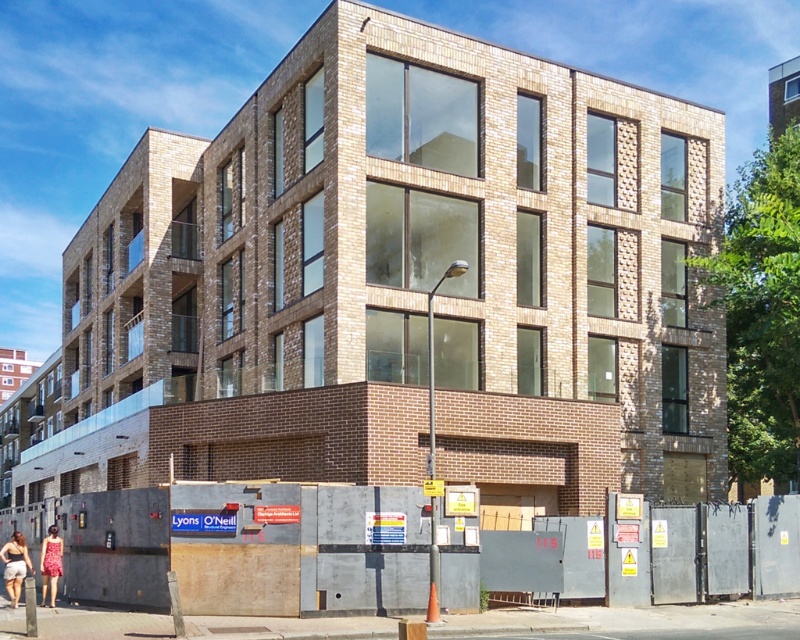
Question: Is light pink cotton dress at lower left to the right of floral dress at lower left from the viewer's perspective?

Choices:
 (A) no
 (B) yes

Answer: (A)

Question: Which object appears farthest from the camera in this image?

Choices:
 (A) floral dress at lower left
 (B) light pink cotton dress at lower left

Answer: (A)

Question: Is the position of light pink cotton dress at lower left less distant than that of floral dress at lower left?

Choices:
 (A) no
 (B) yes

Answer: (B)

Question: Can you confirm if light pink cotton dress at lower left is bigger than floral dress at lower left?

Choices:
 (A) yes
 (B) no

Answer: (A)

Question: Which point is farther from the camera taking this photo?

Choices:
 (A) (4, 570)
 (B) (56, 557)

Answer: (B)